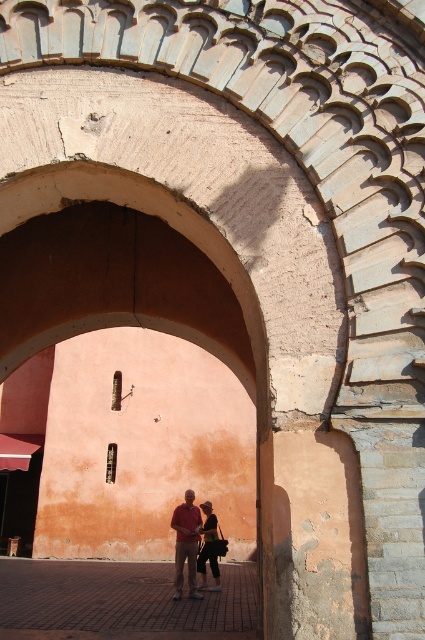
From the picture: You are standing in front of an ancient stone archway. You notice two items hanging on a hook at the center of the archway. The items are the matte red shirt at center and the dark brown leather jacket at center. Which item is closer to the ground?

The matte red shirt at center is positioned under the dark brown leather jacket at center, so the matte red shirt at center is closer to the ground.

You are a fashion designer observing an ancient stone archway scene. You notice a matte red shirt at center and a dark brown leather jacket at center. Can you determine if the distance between them is sufficient for a person to comfortably walk between them without touching either?

The distance between the matte red shirt at center and the dark brown leather jacket at center is 1.74 meters, which is more than enough for a person to comfortably walk between them without touching either item.